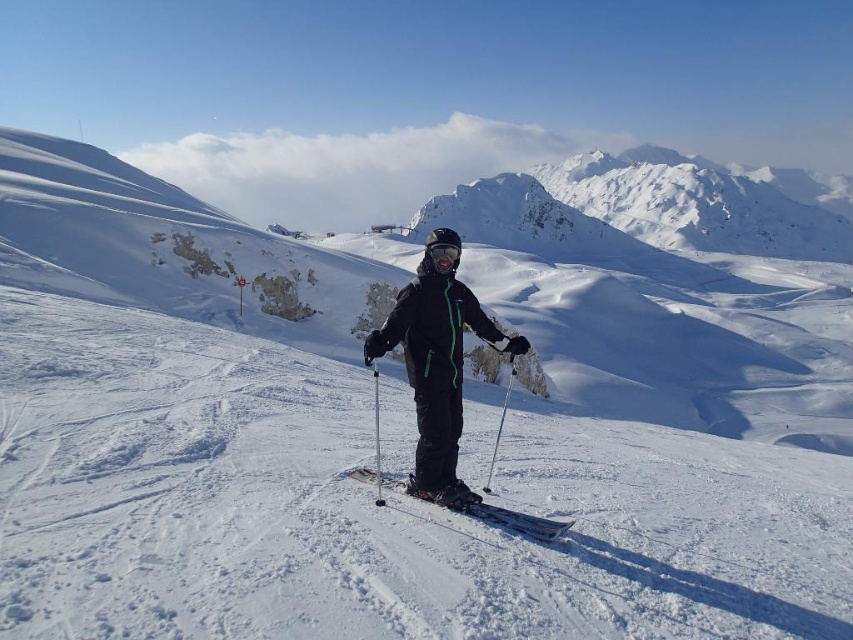
You are a photographer trying to capture the skier in the image. You want to adjust your camera focus to ensure both the black matte ski suit at center and the black matte goggles at center are in sharp view. Based on their positions, which object should you focus on first to ensure both are in focus?

The black matte ski suit at center is to the left of black matte goggles at center. To ensure both are in focus, you should focus on the black matte ski suit at center first since it is closer to the left edge, allowing the depth of field to cover both objects effectively.

You are a photographer trying to capture the black matte ski suit at center and the metallic silver ski pole at center in a single shot. Which object will appear larger in your photo?

The black matte ski suit at center will appear larger in the photo because it is bigger than the metallic silver ski pole at center.

Consider the image. You are a photographer taking a picture of the snowy granite mountain at upper center and the black matte goggles at center. Based on their positions, which object is higher in the image?

The snowy granite mountain at upper center is located above the black matte goggles at center, so it is higher in the image.